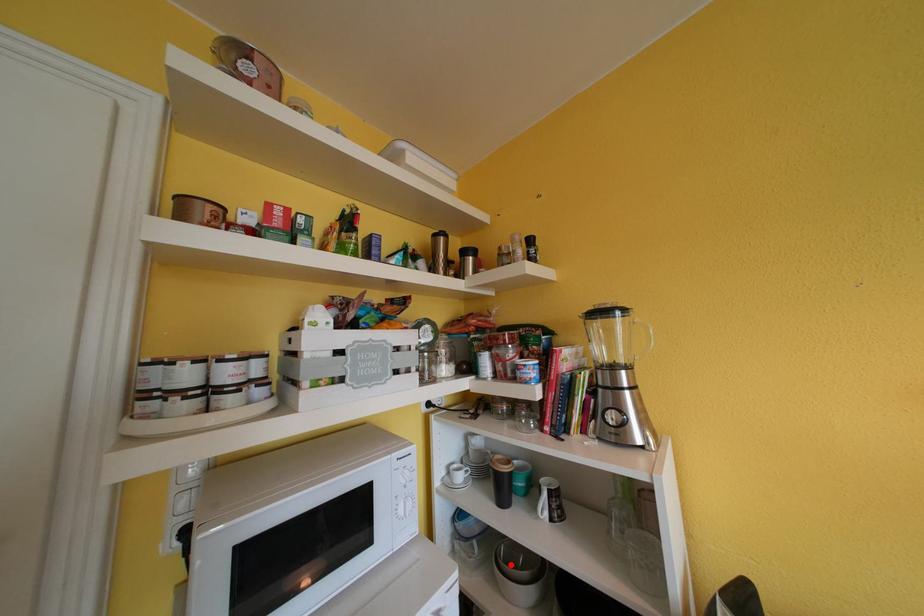
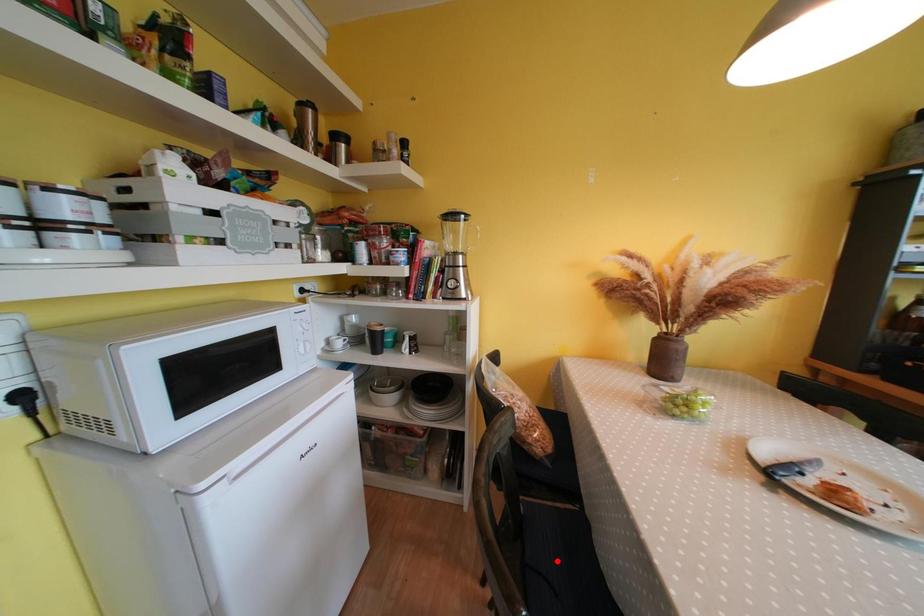
I am providing you with two images of the same scene from different viewpoints. A red point is marked on the first image and another point is marked on the second image. Are the points marked in image1 and image2 representing the same 3D position?

No